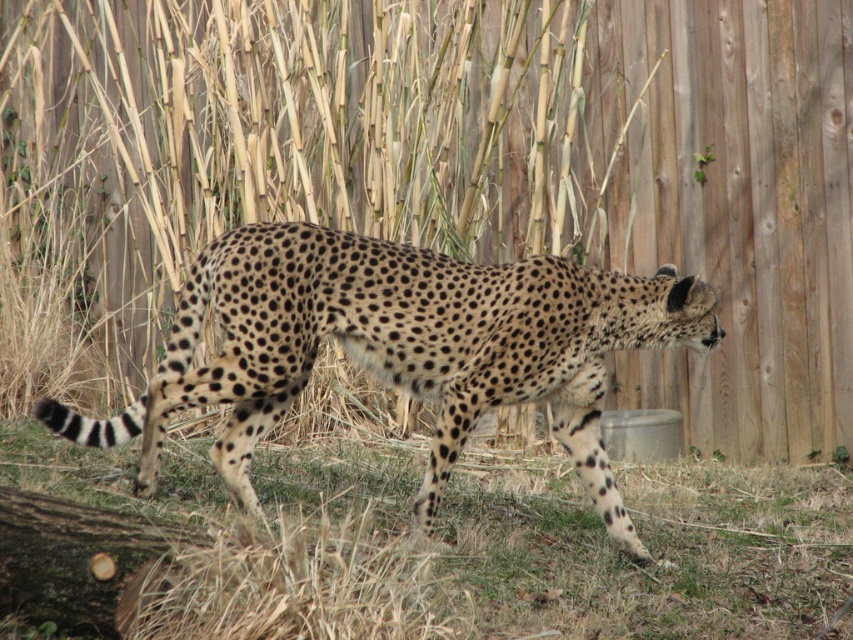
Based on the photo, you are a photographer taking a picture of the cheetah in the zoo. You notice two points marked in the image, point 1 at coordinates point (415, 70) and point 2 at coordinates point (485, 292). Which point is closer to your camera lens?

Point (485, 292) is closer to the camera lens because it is less further away than point (415, 70).

You are standing in a wildlife sanctuary and see the wooden fence at center. If you walk straight ahead, will you eventually reach the cheetah?

The wooden fence at center is located at point (468, 163), so walking straight ahead might not necessarily lead you to the cheetah since the fence is at a specific coordinate which may block or divert the path.